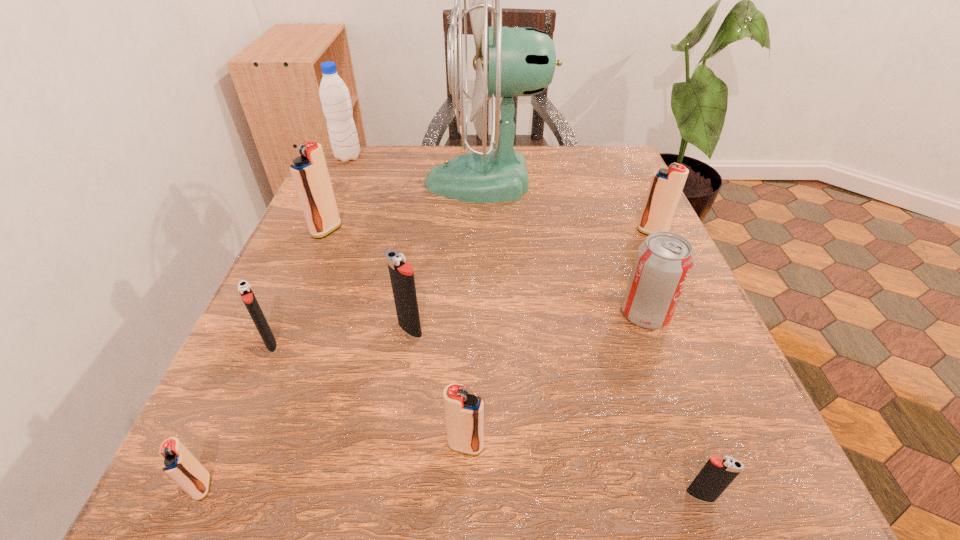
Identify the location of the tallest object. (521, 61).

You are a GUI agent. You are given a task and a screenshot of the screen. Output one action in this format:
    pyautogui.click(x=<x>, y=<y>)
    Task: Click on the fan
    The height and width of the screenshot is (540, 960).
    Given the screenshot: What is the action you would take?
    pyautogui.click(x=521, y=61)

The width and height of the screenshot is (960, 540). Find the location of `water bottle`. water bottle is located at coordinates (335, 99).

This screenshot has height=540, width=960. I want to click on the ninth shortest object, so click(335, 99).

Locate an element on the screen. This screenshot has width=960, height=540. the tallest igniter is located at coordinates (309, 171).

In order to click on the biggest red igniter in this screenshot , I will do `click(309, 171)`.

Identify the location of the rightmost object. Image resolution: width=960 pixels, height=540 pixels. (666, 186).

The image size is (960, 540). Find the location of `the rightmost igniter`. the rightmost igniter is located at coordinates (666, 186).

This screenshot has height=540, width=960. In order to click on the fourth igniter from right to left in this screenshot , I will do `click(401, 273)`.

Where is `the second black igniter from right to left`? This screenshot has width=960, height=540. the second black igniter from right to left is located at coordinates (401, 273).